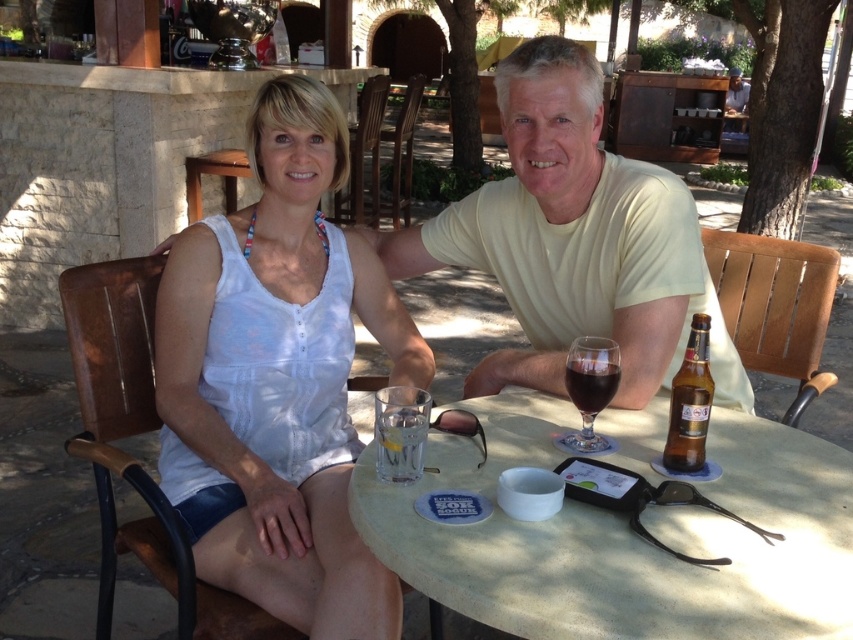
Question: Which object appears farthest from the camera in this image?

Choices:
 (A) white fabric shirt at upper center
 (B) yellow cotton shirt at center
 (C) dark glass wine at center

Answer: (B)

Question: Which of the following is the closest to the observer?

Choices:
 (A) (651, 280)
 (B) (633, 314)
 (C) (602, 444)
 (D) (310, 616)

Answer: (D)

Question: Does smooth stone table at center lie in front of brown glass bottle at table right?

Choices:
 (A) yes
 (B) no

Answer: (A)

Question: Estimate the real-world distances between objects in this image. Which object is closer to the white fabric shirt at upper center?

Choices:
 (A) clear glass at table center
 (B) smooth stone table at center

Answer: (B)

Question: Can you confirm if yellow cotton shirt at center is thinner than clear glass at table center?

Choices:
 (A) no
 (B) yes

Answer: (A)

Question: Can you confirm if brown glass bottle at table right is smaller than transparent glass at table center?

Choices:
 (A) no
 (B) yes

Answer: (A)